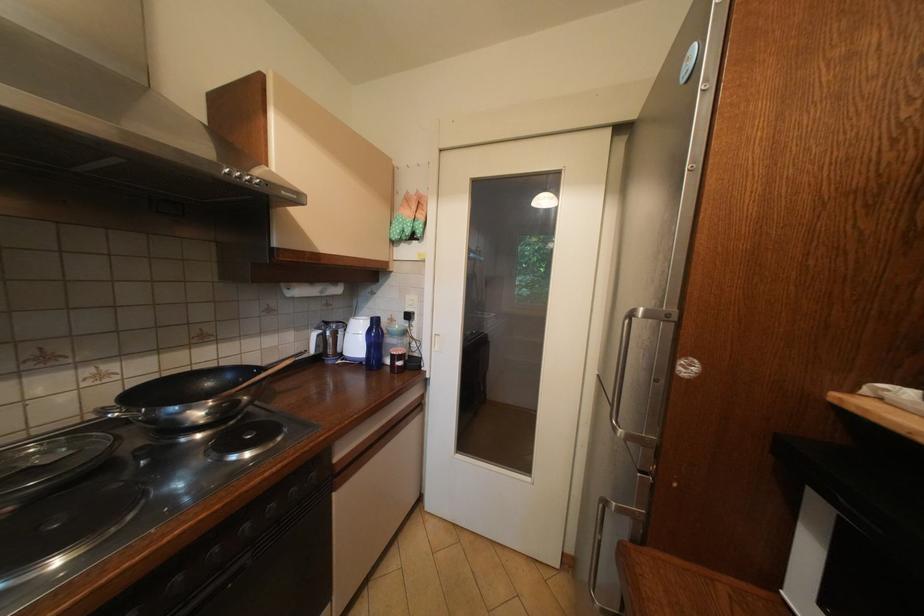
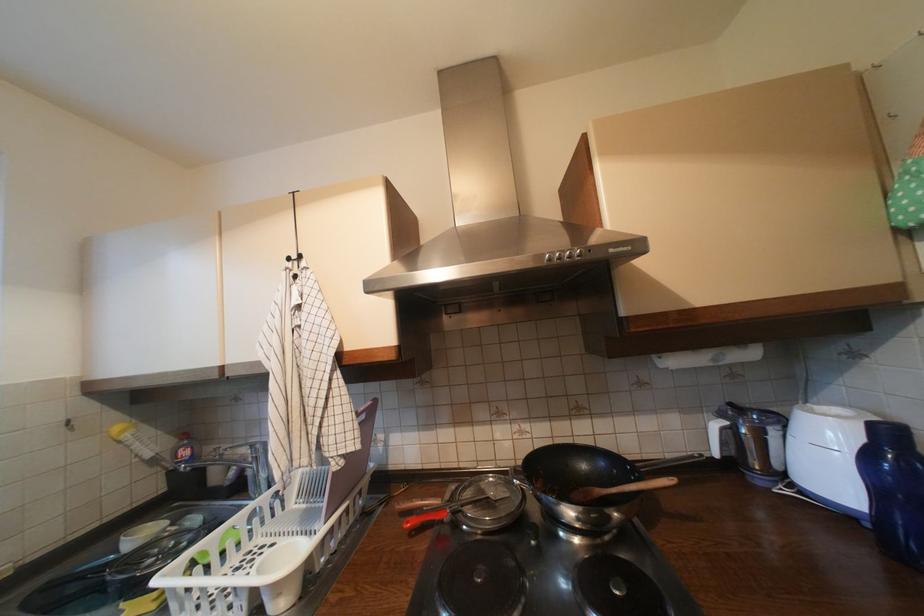
Question: How did the camera likely rotate?

Choices:
 (A) Left
 (B) Right
 (C) Up
 (D) Down

Answer: (A)